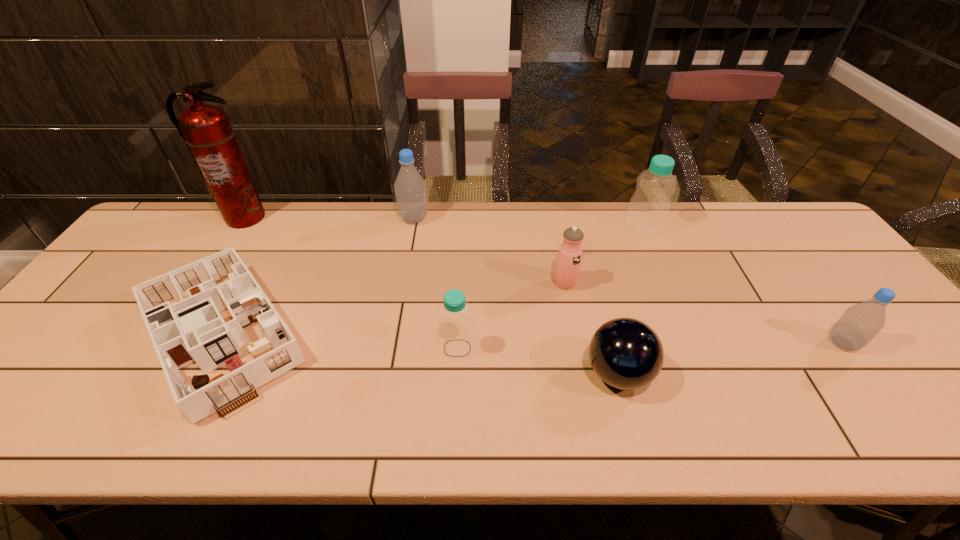
Find the location of a particular element. blank space located 0.200m on the side of the seventh tallest object with the finger holes is located at coordinates (496, 374).

Find the location of a particular element. blank area located 0.330m on the side of the seventh tallest object with the finger holes is located at coordinates (439, 374).

You are a GUI agent. You are given a task and a screenshot of the screen. Output one action in this format:
    pyautogui.click(x=<x>, y=<y>)
    Task: Click on the free spot located on the right of the shortest object
    This screenshot has width=960, height=540.
    Given the screenshot: What is the action you would take?
    pyautogui.click(x=342, y=330)

Identify the location of fire extinguisher at the far edge. (205, 129).

In order to click on object at the near edge in this screenshot , I will do 189,318.

Where is `object that is at the left edge`? This screenshot has width=960, height=540. object that is at the left edge is located at coordinates (189, 318).

The image size is (960, 540). I want to click on object positioned at the right edge, so click(x=859, y=324).

This screenshot has width=960, height=540. Identify the location of object located in the near left corner section of the desktop. (189, 318).

I want to click on vacant point at the far edge, so click(716, 237).

Identify the location of free space at the near edge of the desktop. (61, 430).